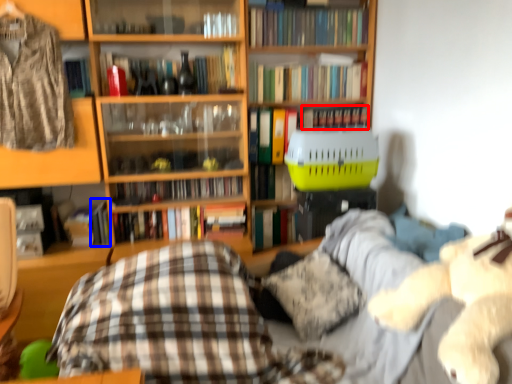
Question: Which of the following is the farthest to the observer, book (highlighted by a red box) or book (highlighted by a blue box)?

Choices:
 (A) book
 (B) book

Answer: (A)